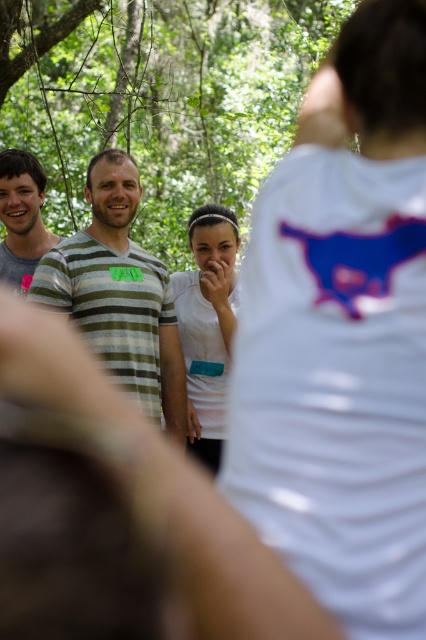
You are part of a group photo in a forest setting. You notice two people in the front row wearing a white matte shirt at center and a green striped shirt at center. Which person is standing closer to the camera?

The white matte shirt at center is positioned under the green striped shirt at center, meaning it is closer to the camera.

You are standing in the forest and see two points in the image. The first point is at coordinates point (279, 426) and the second is at point (92, 168). Which point is closer to you?

Point (279, 426) is closer to the viewer than point (92, 168).

Consider the image. You are part of a group in a forest and need to identify the tallest person. You see the white matte shirt at center and the striped cotton shirt at left. Which one is taller?

The striped cotton shirt at left is taller than the white matte shirt at center.